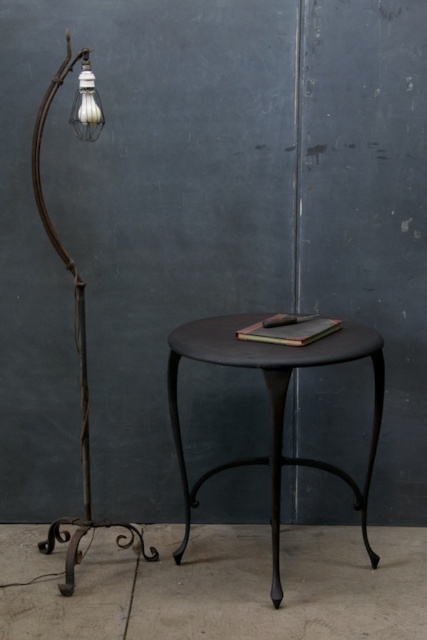
You are an interior designer planning to place a new decorative item between the matte black table at center and the matte white bulb at upper left. Considering their widths, which object should you place closer to the narrower one to maintain balance?

The matte black table at center is wider than the matte white bulb at upper left. To maintain balance, place the decorative item closer to the matte white bulb at upper left since it is narrower.

You are a delivery person who needs to place a package on the matte black table at center without hitting the matte white bulb at upper left. Can you do it?

The matte black table at center is taller than the matte white bulb at upper left, so yes, you can place the package on the matte black table at center without hitting the matte white bulb at upper left.